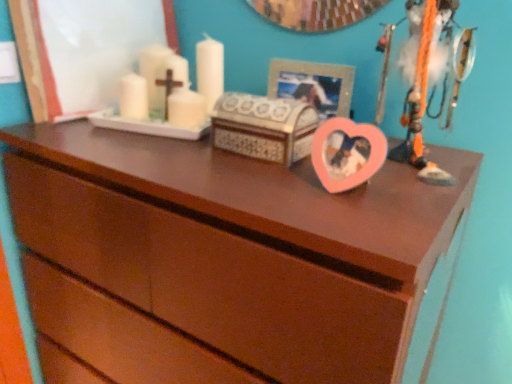
What is the approximate width of pink plastic heart at upper right?

The width of pink plastic heart at upper right is 5.72 inches.

The image size is (512, 384). I want to click on metallic silver picture frame at upper center, so tap(313, 85).

Based on the photo, between metallic silver picture frame at upper center and pink plastic heart at upper right, which one has smaller size?

metallic silver picture frame at upper center.

From a real-world perspective, is metallic silver picture frame at upper center beneath pink plastic heart at upper right?

Yes, from a real-world perspective, metallic silver picture frame at upper center is under pink plastic heart at upper right.

From the image's perspective, which one is positioned higher, metallic silver picture frame at upper center or pink plastic heart at upper right?

metallic silver picture frame at upper center is shown above in the image.

Would you consider metallic silver picture frame at upper center to be distant from pink plastic heart at upper right?

They are positioned close to each other.

Can we say brown wood chest of drawers at center lies outside metallic silver picture frame at upper center?

brown wood chest of drawers at center is positioned outside metallic silver picture frame at upper center.

The height and width of the screenshot is (384, 512). Find the location of `picture frame that appears above the brown wood chest of drawers at center (from a real-world perspective)`. picture frame that appears above the brown wood chest of drawers at center (from a real-world perspective) is located at coordinates (313, 85).

From the image's perspective, relative to metallic silver picture frame at upper center, is brown wood chest of drawers at center above or below?

brown wood chest of drawers at center is below metallic silver picture frame at upper center.

Considering the sizes of objects brown wood chest of drawers at center and metallic silver picture frame at upper center in the image provided, who is taller, brown wood chest of drawers at center or metallic silver picture frame at upper center?

brown wood chest of drawers at center is taller.

Are pink plastic heart at upper right and metallic silver picture frame at upper center far apart?

No.

Is pink plastic heart at upper right surrounding metallic silver picture frame at upper center?

No.

From the image's perspective, between pink plastic heart at upper right and metallic silver picture frame at upper center, who is located below?

From the image's view, pink plastic heart at upper right is below.

Is pink plastic heart at upper right in front of or behind brown wood chest of drawers at center in the image?

pink plastic heart at upper right is behind brown wood chest of drawers at center.

Does pink plastic heart at upper right appear on the left side of brown wood chest of drawers at center?

Incorrect, pink plastic heart at upper right is not on the left side of brown wood chest of drawers at center.

Considering the sizes of pink plastic heart at upper right and brown wood chest of drawers at center in the image, is pink plastic heart at upper right taller or shorter than brown wood chest of drawers at center?

Considering their sizes, pink plastic heart at upper right has less height than brown wood chest of drawers at center.

Between point (421, 40) and point (143, 318), which one is positioned behind?

The point (143, 318) is behind.

Which is in front, point (341, 213) or point (410, 113)?

The point (341, 213) is closer.

Find the location of `toy above the brown wood chest of drawers at center (from a real-world perspective)`. toy above the brown wood chest of drawers at center (from a real-world perspective) is located at coordinates (430, 78).

From a real-world perspective, is brown wood chest of drawers at center above or below pink plastic heart at upper right?

From a real-world perspective, brown wood chest of drawers at center is physically below pink plastic heart at upper right.

Measure the distance between brown wood chest of drawers at center and pink plastic heart at upper right.

A distance of 14.65 inches exists between brown wood chest of drawers at center and pink plastic heart at upper right.

Which is more to the right, metallic silver picture frame at upper center or brown wood chest of drawers at center?

metallic silver picture frame at upper center.

I want to click on chest of drawers in front of the metallic silver picture frame at upper center, so click(x=223, y=258).

Is metallic silver picture frame at upper center with brown wood chest of drawers at center?

No, metallic silver picture frame at upper center is not in contact with brown wood chest of drawers at center.

Based on the photo, is metallic silver picture frame at upper center spatially inside brown wood chest of drawers at center, or outside of it?

metallic silver picture frame at upper center exists outside the volume of brown wood chest of drawers at center.

Find the location of a particular element. picture frame that is under the pink plastic heart at upper right (from a real-world perspective) is located at coordinates (313, 85).

The width and height of the screenshot is (512, 384). In order to click on picture frame behind the brown wood chest of drawers at center in this screenshot , I will do `click(313, 85)`.

When comparing their distances from pink plastic heart at upper right, does brown wood chest of drawers at center or metallic silver picture frame at upper center seem further?

The object further to pink plastic heart at upper right is brown wood chest of drawers at center.

Which object lies further to the anchor point metallic silver picture frame at upper center, brown wood chest of drawers at center or pink plastic heart at upper right?

The object further to metallic silver picture frame at upper center is brown wood chest of drawers at center.

Estimate the real-world distances between objects in this image. Which object is closer to brown wood chest of drawers at center, pink plastic heart at upper right or metallic silver picture frame at upper center?

The object closer to brown wood chest of drawers at center is pink plastic heart at upper right.

From the image, which object appears to be nearer to pink plastic heart at upper right, metallic silver picture frame at upper center or brown wood chest of drawers at center?

metallic silver picture frame at upper center.

When comparing their distances from metallic silver picture frame at upper center, does pink plastic heart at upper right or brown wood chest of drawers at center seem closer?

Based on the image, pink plastic heart at upper right appears to be nearer to metallic silver picture frame at upper center.

Looking at this image, from the image, which object appears to be farther from brown wood chest of drawers at center, metallic silver picture frame at upper center or pink plastic heart at upper right?

metallic silver picture frame at upper center lies further to brown wood chest of drawers at center than the other object.

In order to click on toy between metallic silver picture frame at upper center and brown wood chest of drawers at center in the up-down direction in this screenshot , I will do `click(430, 78)`.